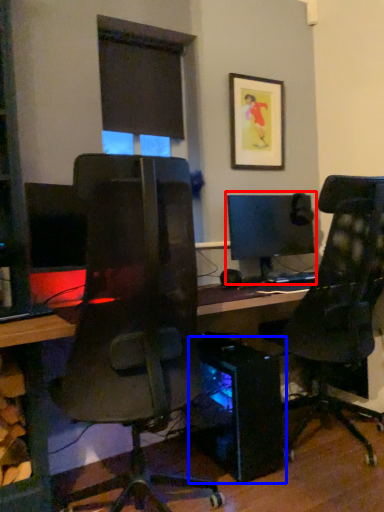
Question: Which point is further to the camera, computer monitor (highlighted by a red box) or computer tower (highlighted by a blue box)?

Choices:
 (A) computer monitor
 (B) computer tower

Answer: (A)